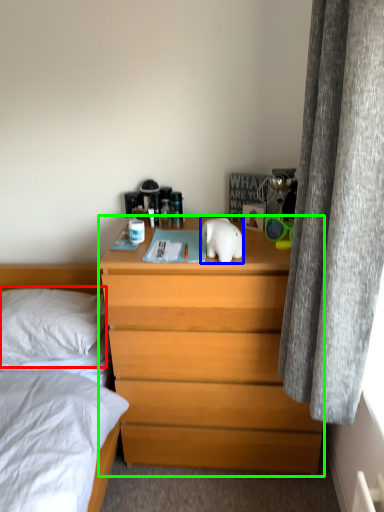
Question: Which is farther away from pillow (highlighted by a red box)? animal (highlighted by a blue box) or chest of drawers (highlighted by a green box)?

Choices:
 (A) animal
 (B) chest of drawers

Answer: (A)